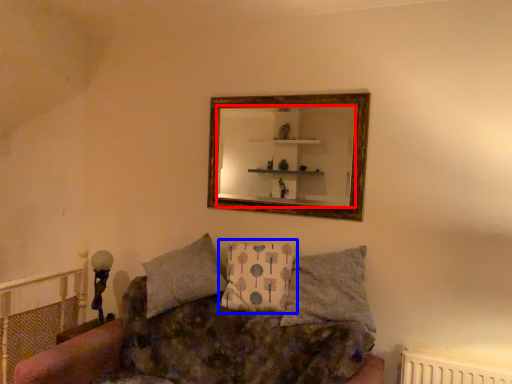
Question: Which object is closer to the camera taking this photo, mirror (highlighted by a red box) or pillow (highlighted by a blue box)?

Choices:
 (A) mirror
 (B) pillow

Answer: (B)